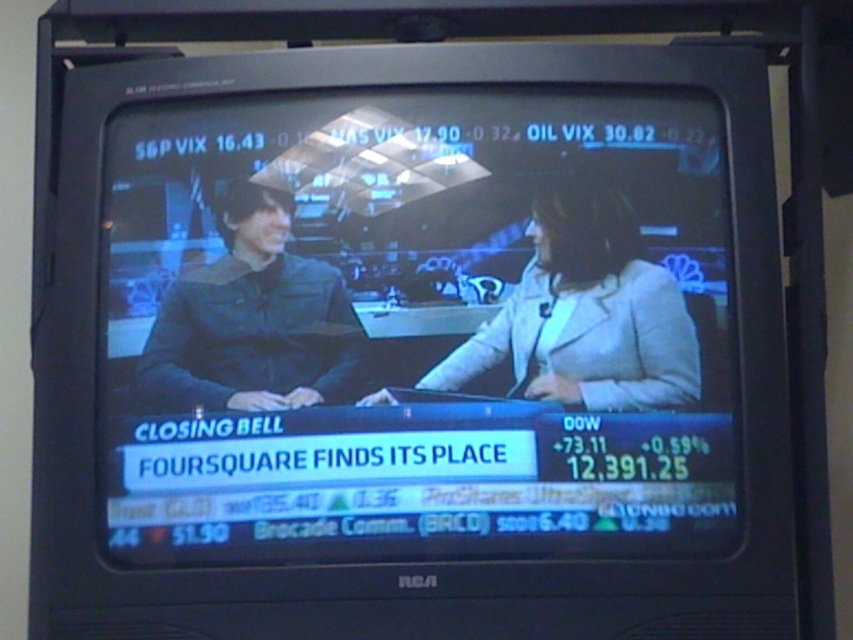
What is the spatial relationship between the matte black monitor at center and the light gray suit at center in the scene?

The matte black monitor at center is located below the light gray suit at center.

You are standing 1.15 meters away from the CRT television. The point on the screen at coordinates (x=566, y=243) is where the news ticker starts. Can you reach that point with your outstretched hand without moving closer?

The point at coordinates (x=566, y=243) is 1.15 meters away from you. Since you are already standing 1.15 meters away, you can just reach it with your outstretched hand.